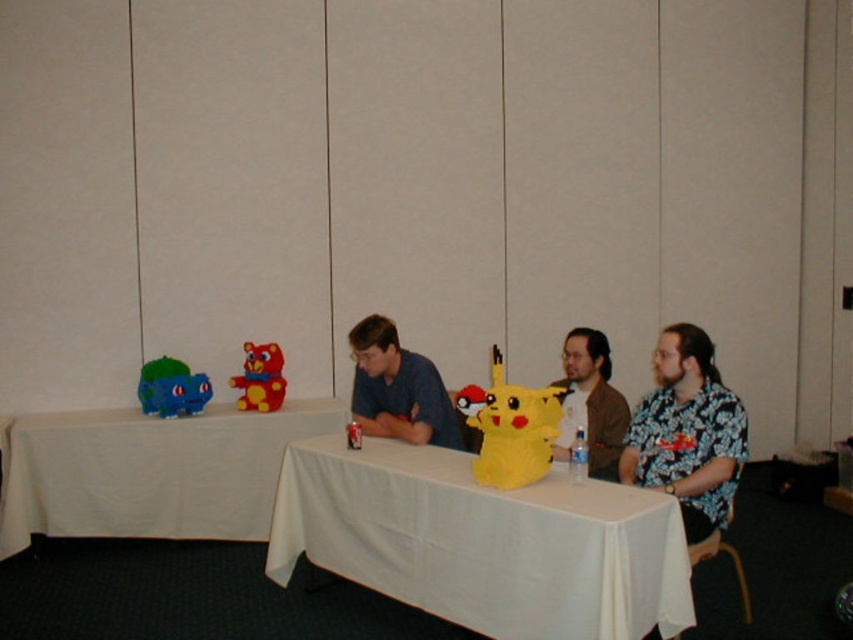
The width and height of the screenshot is (853, 640). Describe the element at coordinates (511, 428) in the screenshot. I see `yellow plush toy at center` at that location.

Which is in front, point (535, 452) or point (154, 381)?

Positioned in front is point (535, 452).

In order to click on yellow plush toy at center in this screenshot , I will do `click(511, 428)`.

Who is taller, white cloth table at center or brown textured shirt at center?

brown textured shirt at center is taller.

Does point (439, 573) lie in front of point (581, 330)?

Yes, it is.

Is point (393, 595) more distant than point (590, 460)?

No, (393, 595) is in front of (590, 460).

Find the location of a particular element. The image size is (853, 640). white cloth table at center is located at coordinates (483, 541).

Which is in front, point (625, 624) or point (192, 404)?

Positioned in front is point (625, 624).

The image size is (853, 640). In order to click on white cloth table at center in this screenshot , I will do [483, 541].